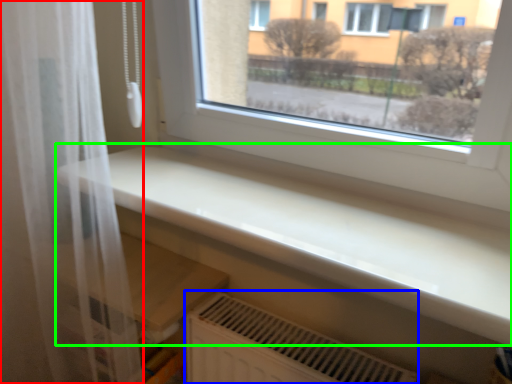
Question: Based on their relative distances, which object is farther from shower curtain (highlighted by a red box)? Choose from air conditioning (highlighted by a blue box) and counter top (highlighted by a green box).

Choices:
 (A) air conditioning
 (B) counter top

Answer: (A)